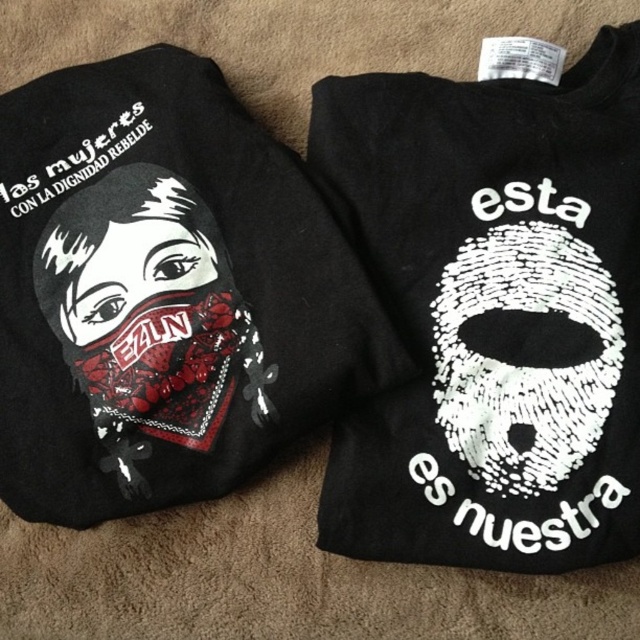
Between point (445, 488) and point (147, 204), which one is positioned in front?

Positioned in front is point (445, 488).

Find the location of a particular element. black matte t-shirt at center is located at coordinates (492, 312).

Locate an element on the screen. This screenshot has height=640, width=640. black matte t-shirt at center is located at coordinates (492, 312).